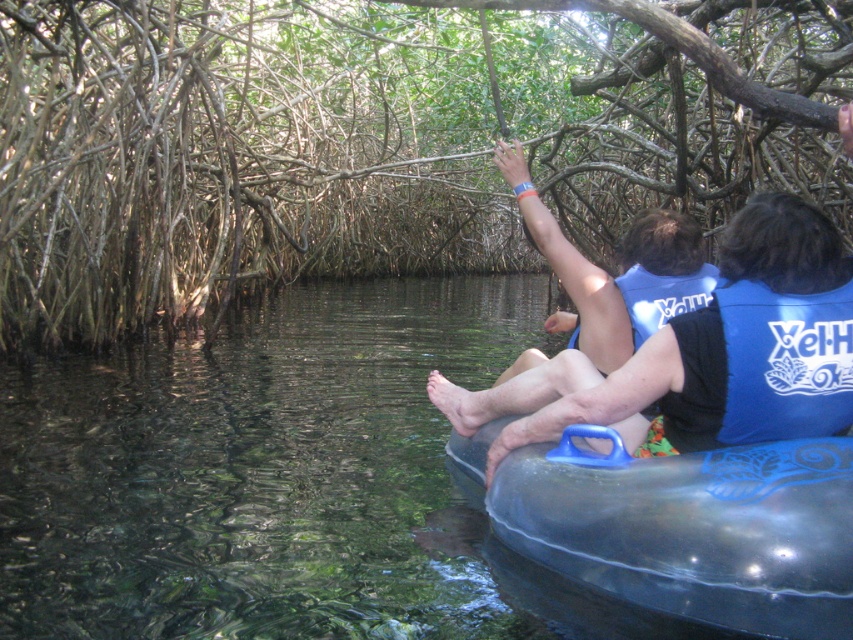
You are standing at the point labeled point (206,308) in a serene mangrove waterway. You want to take a photo of the entire scene with your camera. Given that the point and your camera are 52.50 feet apart, is the distance sufficient to capture the entire scene in one shot?

The point labeled point (206,308) and the camera are 52.50 feet apart. To capture the entire scene in one shot, you need to ensure the camera is positioned far enough back. Since the distance is 52.50 feet, which is likely sufficient for capturing the entire scene given the narrow waterway and surrounding mangroves, the answer is yes.

You are standing at the point marked as point (10, 125) in the image. You want to throw a small pebble to the viewer who is 8.43 meters away. What is the minimum distance you need to throw the pebble to reach them?

The minimum distance you need to throw the pebble is 8.43 meters to reach the viewer, as they are exactly 8.43 meters away from point (10, 125).

You are a tour guide at Xel Ha and need to ensure safety for your guests. You notice the brown textured tree roots at center and the blue fabric life jacket at center. Which object is positioned higher in the scene?

The brown textured tree roots at center are located above the blue fabric life jacket at center, so the tree roots are higher in the scene.